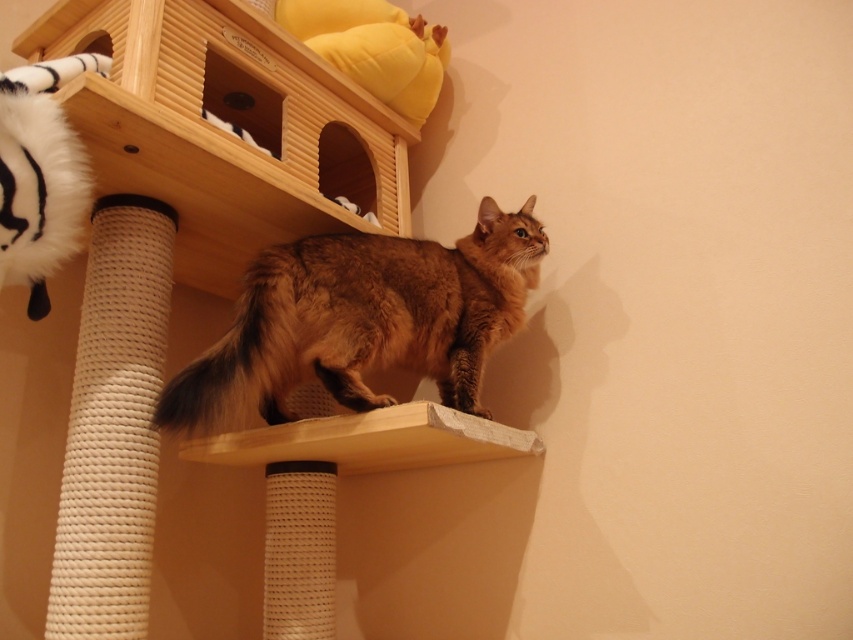
Looking at this image, who is positioned more to the right, brown furry cat at center or brown fur at upper center?

From the viewer's perspective, brown furry cat at center appears more on the right side.

Consider the image. Can you confirm if brown furry cat at center is positioned to the right of brown fur at upper center?

Indeed, brown furry cat at center is positioned on the right side of brown fur at upper center.

Is point (299, 356) more distant than point (280, 284)?

Yes, it is behind point (280, 284).

Locate an element on the screen. This screenshot has width=853, height=640. brown furry cat at center is located at coordinates (363, 321).

Can you confirm if light wood/rough surface ledge at center is positioned below white textured rope at lower center?

No.

Is light wood/rough surface ledge at center thinner than white textured rope at lower center?

No.

Locate an element on the screen. light wood/rough surface ledge at center is located at coordinates (370, 440).

Does point (126, 433) lie in front of point (289, 358)?

Yes, point (126, 433) is in front of point (289, 358).

Is white textured scratching post at left positioned behind brown fur at upper center?

No, white textured scratching post at left is in front of brown fur at upper center.

I want to click on white textured scratching post at left, so click(113, 426).